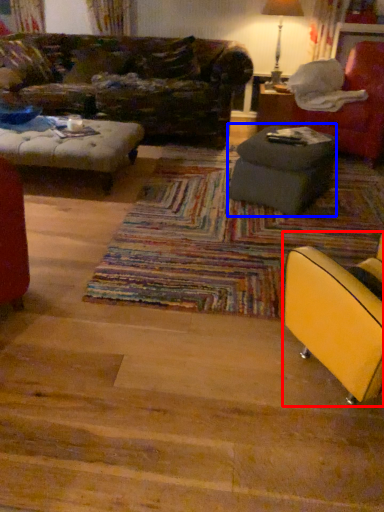
Question: Which object appears closest to the camera in this image, chair (highlighted by a red box) or table (highlighted by a blue box)?

Choices:
 (A) chair
 (B) table

Answer: (A)